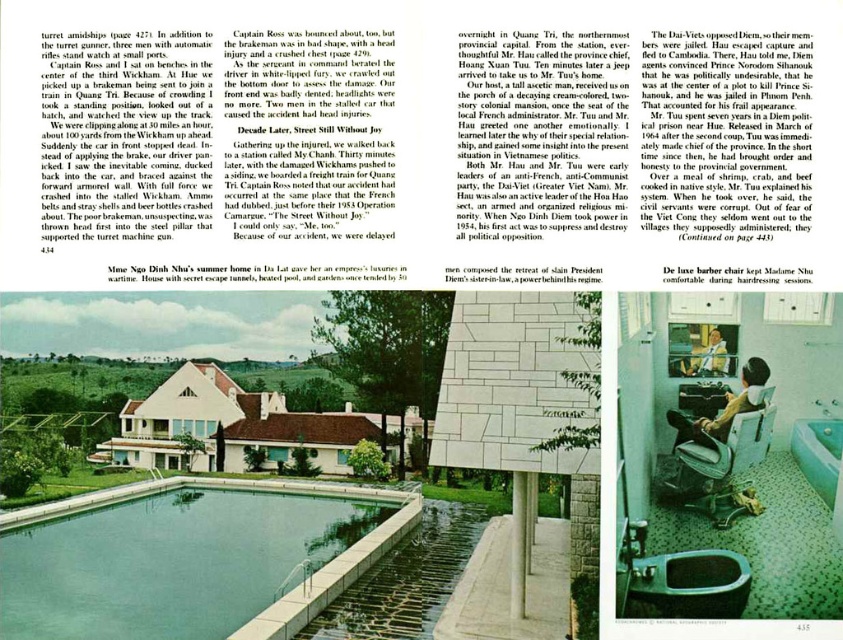
Between point (368, 484) and point (736, 557), which one is positioned in front?

Positioned in front is point (736, 557).

Based on the photo, who is higher up, green concrete pool at center or matte porcelain toilet bowl at lower center?

Positioned higher is matte porcelain toilet bowl at lower center.

At what (x,y) coordinates should I click in order to perform the action: click on green concrete pool at center. Please return your answer as a coordinate pair (x, y). Image resolution: width=843 pixels, height=640 pixels. Looking at the image, I should click on (266, 492).

Based on the photo, does green concrete pool at center have a lesser width compared to light brown wooden chair at lower center?

Incorrect, green concrete pool at center's width is not less than light brown wooden chair at lower center's.

Is green concrete pool at center behind light brown wooden chair at lower center?

Yes, it is.

What are the coordinates of `green concrete pool at center` in the screenshot? It's located at (266, 492).

Between point (278, 628) and point (741, 400), which one is positioned behind?

Point (278, 628)

Between point (44, 513) and point (760, 362), which one is positioned in front?

Point (760, 362)

The width and height of the screenshot is (843, 640). Find the location of `green concrete pool at center`. green concrete pool at center is located at coordinates (266, 492).